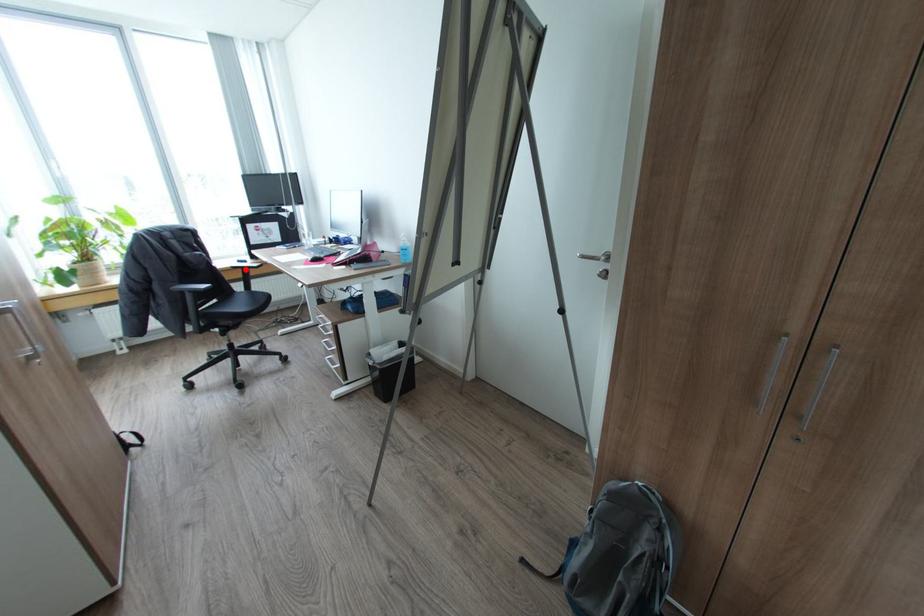
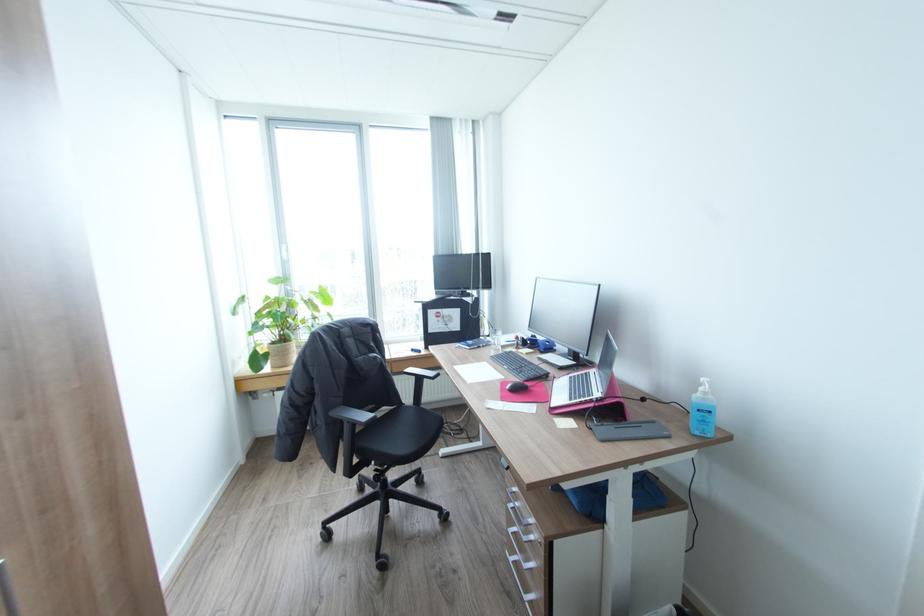
Question: I am providing you with two images of the same scene from different viewpoints. A red point is shown in image1. For the corresponding object point in image2, is it positioned nearer or farther from the camera?

Choices:
 (A) Nearer
 (B) Farther

Answer: (B)